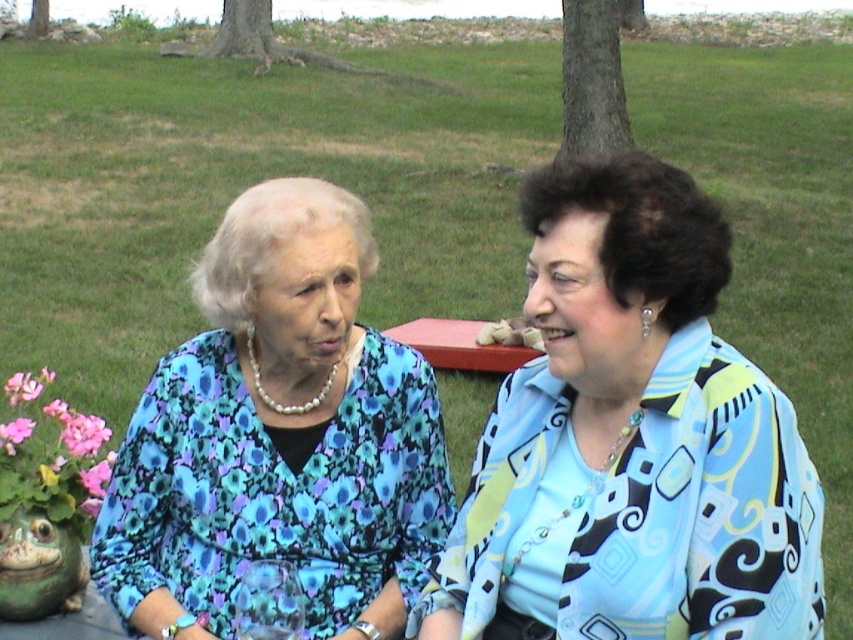
Between floral fabric blouse at center and pink fabric flower at lower left, which one appears on the right side from the viewer's perspective?

floral fabric blouse at center

Does point (213, 570) lie in front of point (65, 496)?

Yes.

Is point (309, 317) behind point (62, 404)?

No, (309, 317) is in front of (62, 404).

Locate an element on the screen. floral fabric blouse at center is located at coordinates (277, 436).

Which is above, light blue printed blouse at right or pink fabric flower at lower left?

pink fabric flower at lower left is higher up.

Is light blue printed blouse at right thinner than pink fabric flower at lower left?

No, light blue printed blouse at right is not thinner than pink fabric flower at lower left.

The image size is (853, 640). What do you see at coordinates (630, 440) in the screenshot? I see `light blue printed blouse at right` at bounding box center [630, 440].

Identify the location of light blue printed blouse at right. The height and width of the screenshot is (640, 853). (630, 440).

Is light blue printed blouse at right wider than floral fabric blouse at center?

No, light blue printed blouse at right is not wider than floral fabric blouse at center.

Between point (701, 582) and point (302, 380), which one is positioned behind?

The point (302, 380) is more distant.

What do you see at coordinates (630, 440) in the screenshot? I see `light blue printed blouse at right` at bounding box center [630, 440].

Where is `light blue printed blouse at right`? The image size is (853, 640). light blue printed blouse at right is located at coordinates (630, 440).